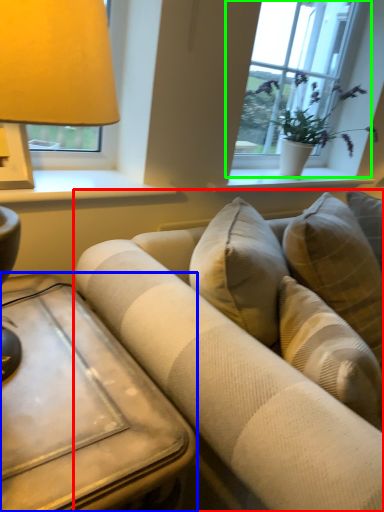
Question: Based on their relative distances, which object is nearer to studio couch (highlighted by a red box)? Choose from table (highlighted by a blue box) and window (highlighted by a green box).

Choices:
 (A) table
 (B) window

Answer: (A)